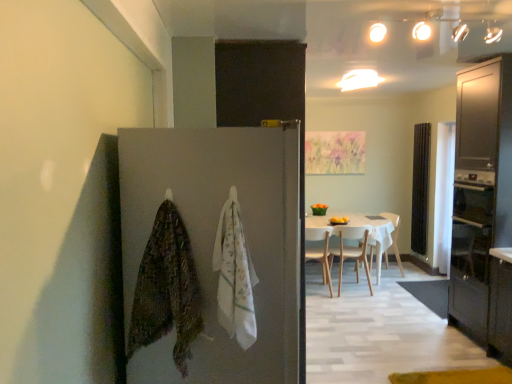
Question: From a real-world perspective, is matte dark wood cabinet at right on white wood chair at center, the 1th chair positioned from the right?

Choices:
 (A) yes
 (B) no

Answer: (A)

Question: Does matte dark wood cabinet at right have a smaller size compared to white wood chair at center, the 1th chair positioned from the right?

Choices:
 (A) no
 (B) yes

Answer: (A)

Question: Is matte dark wood cabinet at right further to the viewer compared to white wood chair at center, the third chair when ordered from left to right?

Choices:
 (A) yes
 (B) no

Answer: (B)

Question: From a real-world perspective, does matte dark wood cabinet at right sit lower than white wood chair at center, the 1th chair positioned from the right?

Choices:
 (A) no
 (B) yes

Answer: (A)

Question: Considering the relative sizes of matte dark wood cabinet at right and white wood chair at center, the third chair when ordered from left to right, in the image provided, is matte dark wood cabinet at right bigger than white wood chair at center, the third chair when ordered from left to right,?

Choices:
 (A) no
 (B) yes

Answer: (B)

Question: Looking at their shapes, would you say white glossy light fixture at upper center is wider or thinner than textured multicolored blanket at left, marked as the 2th blanket in a right-to-left arrangement?

Choices:
 (A) thin
 (B) wide

Answer: (B)

Question: Considering the relative positions of white glossy light fixture at upper center and textured multicolored blanket at left, marked as the 2th blanket in a right-to-left arrangement, in the image provided, is white glossy light fixture at upper center to the left or to the right of textured multicolored blanket at left, marked as the 2th blanket in a right-to-left arrangement,?

Choices:
 (A) right
 (B) left

Answer: (A)

Question: Is white glossy light fixture at upper center taller or shorter than textured multicolored blanket at left, placed as the first blanket when sorted from left to right?

Choices:
 (A) tall
 (B) short

Answer: (B)

Question: From a real-world perspective, relative to textured multicolored blanket at left, marked as the 2th blanket in a right-to-left arrangement, is white glossy light fixture at upper center vertically above or below?

Choices:
 (A) above
 (B) below

Answer: (A)

Question: From a real-world perspective, relative to wooden chair at center, which appears as the third chair when viewed from the right, is black glass oven at right vertically above or below?

Choices:
 (A) above
 (B) below

Answer: (A)

Question: Is black glass oven at right wider or thinner than wooden chair at center, which appears as the third chair when viewed from the right?

Choices:
 (A) thin
 (B) wide

Answer: (B)

Question: Do you think black glass oven at right is within wooden chair at center, which appears as the third chair when viewed from the right, or outside of it?

Choices:
 (A) outside
 (B) inside

Answer: (A)

Question: In the image, is black glass oven at right positioned in front of or behind wooden chair at center, which appears as the third chair when viewed from the right?

Choices:
 (A) front
 (B) behind

Answer: (A)

Question: Considering the positions of point (146, 198) and point (498, 59), is point (146, 198) closer or farther from the camera than point (498, 59)?

Choices:
 (A) farther
 (B) closer

Answer: (B)

Question: From their relative heights in the image, would you say matte gray door at center is taller or shorter than matte dark wood cabinet at right?

Choices:
 (A) tall
 (B) short

Answer: (B)